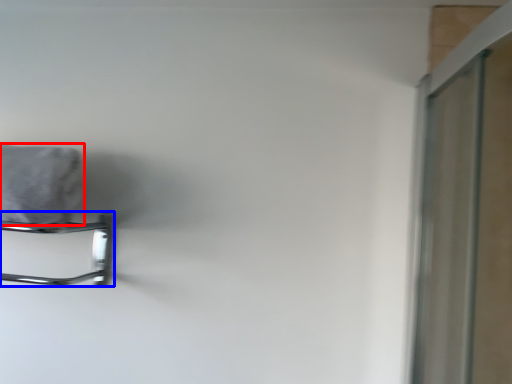
Question: Among these objects, which one is nearest to the camera, bath towel (highlighted by a red box) or towel rack (highlighted by a blue box)?

Choices:
 (A) bath towel
 (B) towel rack

Answer: (A)